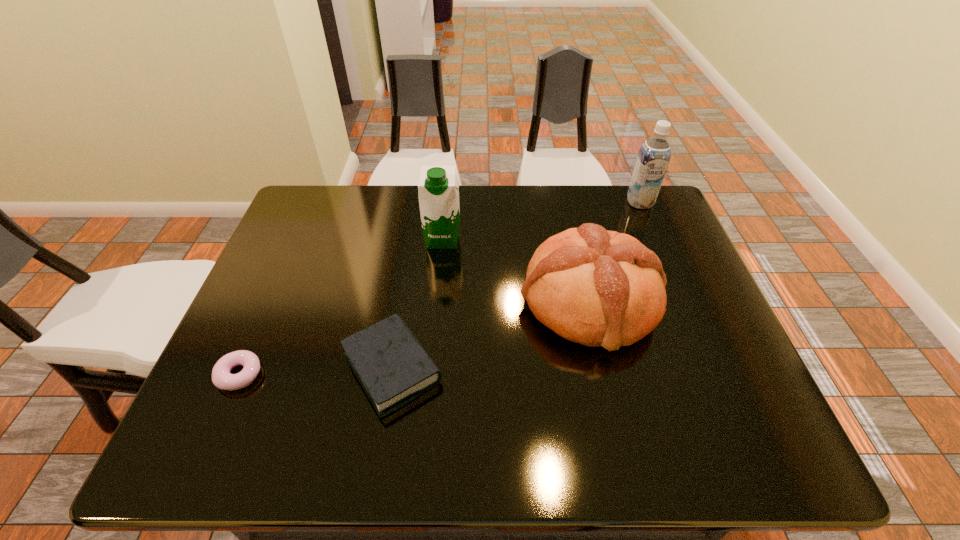
Image resolution: width=960 pixels, height=540 pixels. Identify the location of free space located on the front-facing side of the nearer soya milk. (440, 269).

What are the coordinates of `free space located 0.090m on the back of the bread` in the screenshot? It's located at (574, 232).

The height and width of the screenshot is (540, 960). I want to click on free location located on the back of the Bible, so click(x=414, y=235).

Find the location of `free point located on the right of the doughnut`. free point located on the right of the doughnut is located at coordinates (446, 374).

Locate an element on the screen. This screenshot has width=960, height=540. object present at the left edge is located at coordinates (221, 377).

Find the location of `soya milk positioned at the right edge`. soya milk positioned at the right edge is located at coordinates (654, 155).

The width and height of the screenshot is (960, 540). I want to click on bread located in the right edge section of the desktop, so click(x=595, y=287).

Locate an element on the screen. object present at the far right corner is located at coordinates (654, 155).

In the image, there is a desktop. Identify the location of vacant region at the far edge. (605, 195).

Find the location of a particular element. The height and width of the screenshot is (540, 960). free space at the near edge of the desktop is located at coordinates (551, 455).